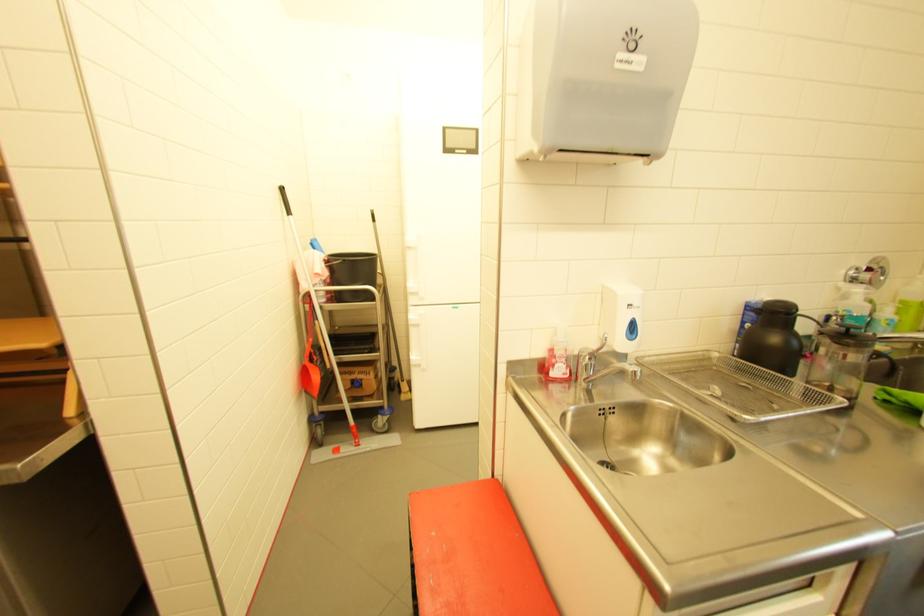
This screenshot has height=616, width=924. Describe the element at coordinates (773, 338) in the screenshot. I see `the glass pitcher handle` at that location.